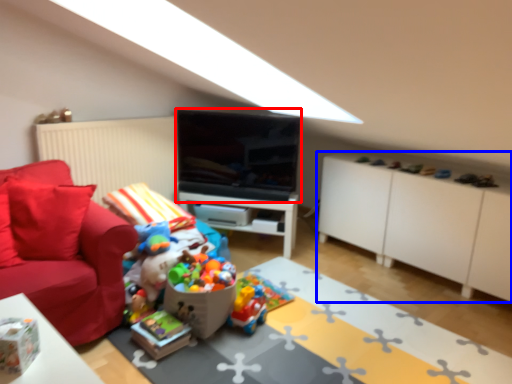
Question: Which of the following is the farthest to the observer, television (highlighted by a red box) or cabinetry (highlighted by a blue box)?

Choices:
 (A) television
 (B) cabinetry

Answer: (A)